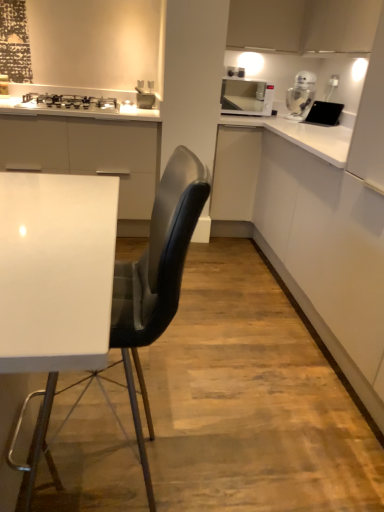
What do you see at coordinates (324, 113) in the screenshot?
I see `black matte tablet at upper right` at bounding box center [324, 113].

You are a GUI agent. You are given a task and a screenshot of the screen. Output one action in this format:
    pyautogui.click(x=<x>, y=<y>)
    Task: Click on the white glossy microwave at upper right
    The width and height of the screenshot is (384, 512).
    Given the screenshot: What is the action you would take?
    pyautogui.click(x=246, y=97)

The width and height of the screenshot is (384, 512). Describe the element at coordinates (300, 95) in the screenshot. I see `clear glass jar at upper right` at that location.

Locate an element on the screen. The width and height of the screenshot is (384, 512). black leather chair at center is located at coordinates (157, 278).

Identify the location of matte white cabinet at upper right. (303, 25).

Locate an element on the screen. black matte tablet at upper right is located at coordinates (324, 113).

Could you tell me if white glossy microwave at upper right is turned towards silver metallic gas stove at upper left?

No.

In the image, is white glossy microwave at upper right positioned in front of or behind silver metallic gas stove at upper left?

Clearly, white glossy microwave at upper right is behind silver metallic gas stove at upper left.

From the picture: Is white glossy microwave at upper right next to silver metallic gas stove at upper left and touching it?

No, white glossy microwave at upper right is not next to silver metallic gas stove at upper left.

Which of these two, white glossy microwave at upper right or silver metallic gas stove at upper left, is thinner?

Thinner between the two is white glossy microwave at upper right.

Locate an element on the screen. The image size is (384, 512). appliance on the right of matte white cabinet at upper right is located at coordinates (324, 113).

Looking at their sizes, would you say black matte tablet at upper right is wider or thinner than matte white cabinet at upper right?

Considering their sizes, black matte tablet at upper right looks slimmer than matte white cabinet at upper right.

Considering the sizes of black matte tablet at upper right and matte white cabinet at upper right in the image, is black matte tablet at upper right bigger or smaller than matte white cabinet at upper right?

In the image, black matte tablet at upper right appears to be smaller than matte white cabinet at upper right.

Is white glossy microwave at upper right not near clear glass jar at upper right?

No, white glossy microwave at upper right is not far away from clear glass jar at upper right.

From the image's perspective, would you say white glossy microwave at upper right is shown under clear glass jar at upper right?

Yes, from the image's perspective, white glossy microwave at upper right is beneath clear glass jar at upper right.

Could clear glass jar at upper right be considered to be inside white glossy microwave at upper right?

No, clear glass jar at upper right is not inside white glossy microwave at upper right.

Can you tell me how much white glossy microwave at upper right and clear glass jar at upper right differ in facing direction?

The facing directions of white glossy microwave at upper right and clear glass jar at upper right are 33.6 degrees apart.

Does silver metallic gas stove at upper left have a larger size compared to matte white cabinet at upper right?

Actually, silver metallic gas stove at upper left might be smaller than matte white cabinet at upper right.

Is silver metallic gas stove at upper left behind matte white cabinet at upper right?

Yes, silver metallic gas stove at upper left is further from the camera.

Is the surface of silver metallic gas stove at upper left in direct contact with matte white cabinet at upper right?

No, silver metallic gas stove at upper left is not next to matte white cabinet at upper right.

Identify the location of gas stove below the matte white cabinet at upper right (from the image's perspective). (68, 103).

Is black matte tablet at upper right completely or partially outside of black leather chair at center?

Yes, black matte tablet at upper right is not within black leather chair at center.

From the image's perspective, would you say black matte tablet at upper right is shown under black leather chair at center?

Incorrect, from the image's perspective, black matte tablet at upper right is higher than black leather chair at center.

From a real-world perspective, is black matte tablet at upper right located higher than black leather chair at center?

Yes, from a real-world perspective, black matte tablet at upper right is above black leather chair at center.

Which of these two, black matte tablet at upper right or black leather chair at center, stands shorter?

Standing shorter between the two is black matte tablet at upper right.

Does matte white cabinet at upper right have a greater width compared to black leather chair at center?

Indeed, matte white cabinet at upper right has a greater width compared to black leather chair at center.

Is matte white cabinet at upper right aimed at black leather chair at center?

No.

Can you tell me how much matte white cabinet at upper right and black leather chair at center differ in facing direction?

The facing directions of matte white cabinet at upper right and black leather chair at center are 0.664 degrees apart.

Visually, is matte white cabinet at upper right positioned to the left or to the right of black leather chair at center?

In the image, matte white cabinet at upper right appears on the right side of black leather chair at center.

Based on the photo, considering the relative positions of silver metallic gas stove at upper left and black leather chair at center in the image provided, is silver metallic gas stove at upper left to the left or to the right of black leather chair at center?

silver metallic gas stove at upper left is positioned on black leather chair at center's left side.

From the picture: Is silver metallic gas stove at upper left positioned with its back to black leather chair at center?

silver metallic gas stove at upper left is not turned away from black leather chair at center.

The image size is (384, 512). I want to click on chair located underneath the silver metallic gas stove at upper left (from a real-world perspective), so click(157, 278).

The height and width of the screenshot is (512, 384). Find the location of `home appliance behind the silver metallic gas stove at upper left`. home appliance behind the silver metallic gas stove at upper left is located at coordinates (246, 97).

Where is `appliance below the matte white cabinet at upper right (from a real-world perspective)`? The width and height of the screenshot is (384, 512). appliance below the matte white cabinet at upper right (from a real-world perspective) is located at coordinates (324, 113).

Estimate the real-world distances between objects in this image. Which object is further from black leather chair at center, clear glass jar at upper right or white glossy microwave at upper right?

Based on the image, white glossy microwave at upper right appears to be further to black leather chair at center.

Based on their spatial positions, is matte white cabinet at upper right or white glossy microwave at upper right closer to black matte tablet at upper right?

The object closer to black matte tablet at upper right is matte white cabinet at upper right.

When comparing their distances from black leather chair at center, does silver metallic gas stove at upper left or black matte tablet at upper right seem further?

black matte tablet at upper right is positioned further to the anchor black leather chair at center.

Consider the image. Estimate the real-world distances between objects in this image. Which object is further from clear glass jar at upper right, black matte tablet at upper right or matte white cabinet at upper right?

Among the two, matte white cabinet at upper right is located further to clear glass jar at upper right.

When comparing their distances from black matte tablet at upper right, does clear glass jar at upper right or black leather chair at center seem further?

black leather chair at center.

From the picture: Which object lies nearer to the anchor point white glossy microwave at upper right, silver metallic gas stove at upper left or black matte tablet at upper right?

black matte tablet at upper right lies closer to white glossy microwave at upper right than the other object.

Which object lies nearer to the anchor point matte white cabinet at upper right, black matte tablet at upper right or clear glass jar at upper right?

Among the two, clear glass jar at upper right is located nearer to matte white cabinet at upper right.

Estimate the real-world distances between objects in this image. Which object is further from black matte tablet at upper right, black leather chair at center or clear glass jar at upper right?

black leather chair at center lies further to black matte tablet at upper right than the other object.

Identify the location of appliance between matte white cabinet at upper right and clear glass jar at upper right from front to back. (324, 113).

Where is `home appliance situated between silver metallic gas stove at upper left and matte white cabinet at upper right from left to right`? This screenshot has height=512, width=384. home appliance situated between silver metallic gas stove at upper left and matte white cabinet at upper right from left to right is located at coordinates (246, 97).

The image size is (384, 512). What are the coordinates of `appliance positioned between black leather chair at center and clear glass jar at upper right from near to far` in the screenshot? It's located at (324, 113).

This screenshot has width=384, height=512. I want to click on gas stove between black leather chair at center and clear glass jar at upper right from front to back, so click(x=68, y=103).